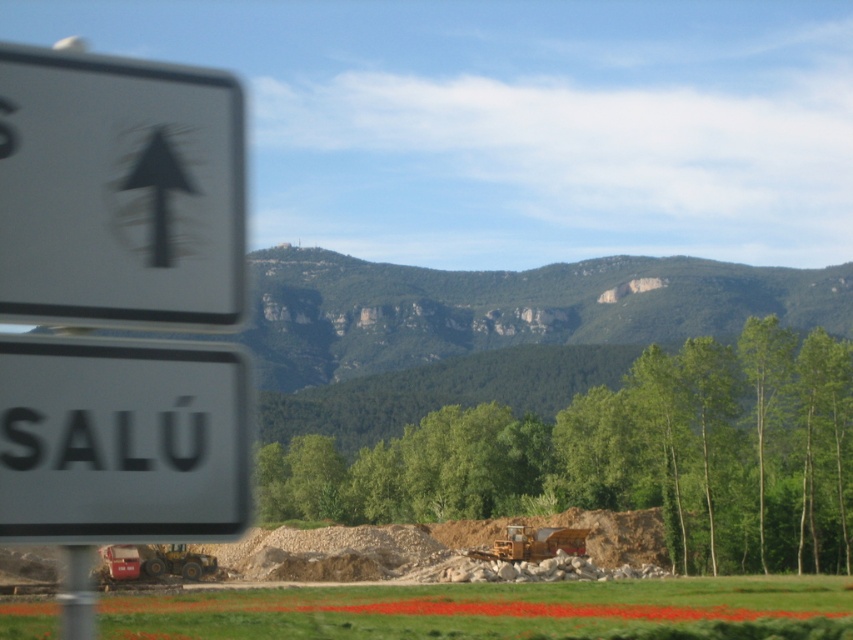
Is white plastic sign at lower left taller than yellow metallic excavator at center?

No.

Can you confirm if white plastic sign at lower left is positioned below yellow metallic excavator at center?

No.

Does point (96, 540) lie in front of point (535, 531)?

Yes, it is.

Locate an element on the screen. This screenshot has width=853, height=640. white plastic sign at lower left is located at coordinates (122, 440).

Is white plastic arrow at upper left to the right of metallic pole at left from the viewer's perspective?

Correct, you'll find white plastic arrow at upper left to the right of metallic pole at left.

Which is behind, point (32, 104) or point (86, 579)?

The point (86, 579) is more distant.

Locate an element on the screen. The image size is (853, 640). white plastic arrow at upper left is located at coordinates (119, 192).

Is white plastic arrow at upper left to the right of white plastic sign at lower left from the viewer's perspective?

Yes, white plastic arrow at upper left is to the right of white plastic sign at lower left.

Who is more distant from viewer, (138, 307) or (67, 472)?

Positioned behind is point (138, 307).

Who is more forward, (x=113, y=60) or (x=82, y=349)?

Point (x=82, y=349) is more forward.

Find the location of a particular element. This screenshot has height=640, width=853. white plastic arrow at upper left is located at coordinates (119, 192).